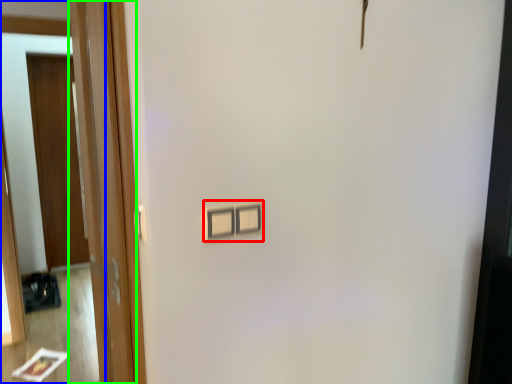
Question: Which object is the farthest from light switch (highlighted by a red box)? Choose among these: mirror (highlighted by a blue box) or door (highlighted by a green box).

Choices:
 (A) mirror
 (B) door

Answer: (A)